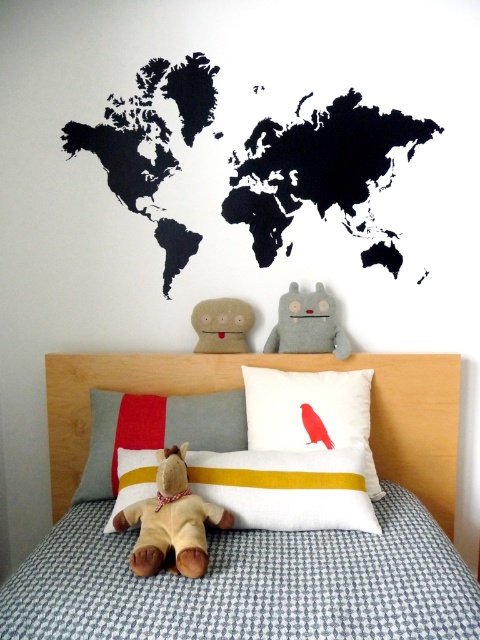
In the scene shown: Is gray fabric pillow with yellow stripe at center to the right of beige fabric plush at center from the viewer's perspective?

No, gray fabric pillow with yellow stripe at center is not to the right of beige fabric plush at center.

Measure the distance between gray fabric pillow with yellow stripe at center and beige fabric plush at center.

The distance of gray fabric pillow with yellow stripe at center from beige fabric plush at center is 13.05 inches.

Is point (244, 420) positioned behind point (242, 307)?

No.

Identify the location of gray fabric pillow with yellow stripe at center. The width and height of the screenshot is (480, 640). (156, 429).

Can you confirm if white/yellow striped pillow at center is positioned to the right of beige plush teddy bear at center?

Correct, you'll find white/yellow striped pillow at center to the right of beige plush teddy bear at center.

Which is below, white/yellow striped pillow at center or beige plush teddy bear at center?

beige plush teddy bear at center is below.

Between point (333, 483) and point (170, 524), which one is positioned in front?

Point (170, 524) is more forward.

What are the coordinates of `white/yellow striped pillow at center` in the screenshot? It's located at (287, 486).

Which is below, white fabric pillow with red bird at center or white/yellow striped pillow at center?

white fabric pillow with red bird at center is lower down.

Is the position of white fabric pillow with red bird at center more distant than that of white/yellow striped pillow at center?

No, it is in front of white/yellow striped pillow at center.

Identify the location of white fabric pillow with red bird at center. (259, 531).

Image resolution: width=480 pixels, height=640 pixels. In order to click on white fabric pillow with red bird at center in this screenshot , I will do (259, 531).